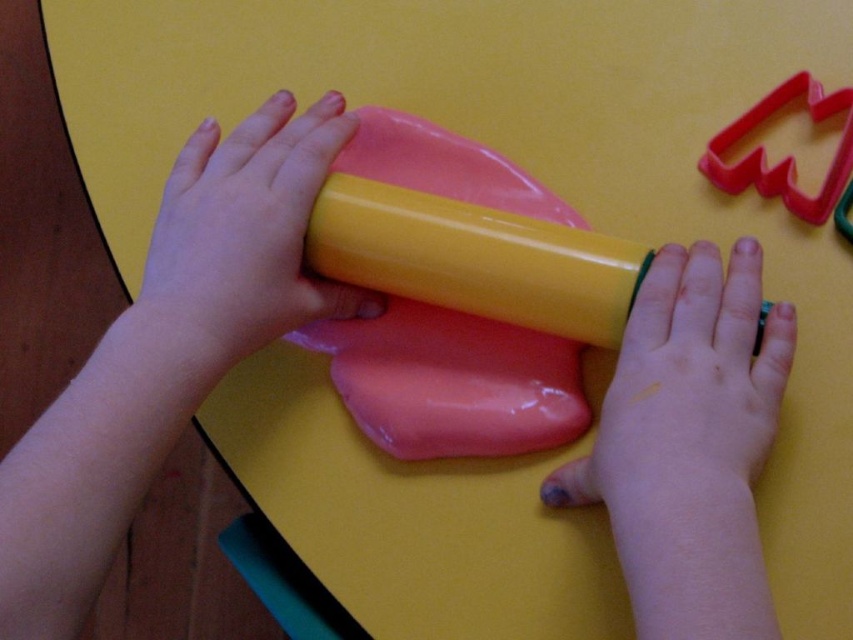
Who is higher up, yellow matte hand at center or yellow glossy rolling pin at center?

yellow glossy rolling pin at center is higher up.

Which is more to the right, yellow matte hand at center or yellow glossy rolling pin at center?

yellow matte hand at center

This screenshot has width=853, height=640. What do you see at coordinates (688, 392) in the screenshot?
I see `yellow matte hand at center` at bounding box center [688, 392].

I want to click on yellow matte hand at center, so click(x=688, y=392).

Can you confirm if yellow matte hand at center is thinner than smooth yellow rolling pin at center?

Yes, yellow matte hand at center is thinner than smooth yellow rolling pin at center.

Between yellow matte hand at center and smooth yellow rolling pin at center, which one appears on the left side from the viewer's perspective?

Positioned to the left is smooth yellow rolling pin at center.

Is point (636, 305) less distant than point (297, 154)?

Yes, point (636, 305) is in front of point (297, 154).

I want to click on yellow matte hand at center, so (x=688, y=392).

Does smooth yellow rolling pin at center have a smaller size compared to yellow glossy rolling pin at center?

No, smooth yellow rolling pin at center is not smaller than yellow glossy rolling pin at center.

What do you see at coordinates (241, 240) in the screenshot? I see `smooth yellow rolling pin at center` at bounding box center [241, 240].

Where is `smooth yellow rolling pin at center`? The width and height of the screenshot is (853, 640). smooth yellow rolling pin at center is located at coordinates (241, 240).